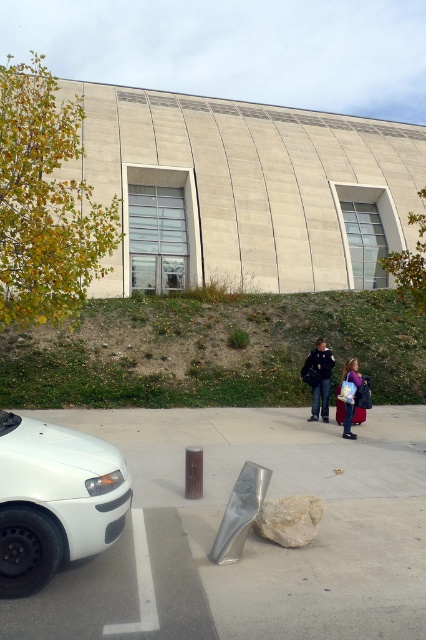
Question: Considering the real-world distances, which object is closest to the metallic silver pavement at lower center?

Choices:
 (A) light beige rock at lower center
 (B) green grassy hillside at lower left
 (C) dark blue jacket at center

Answer: (A)

Question: Does white matte car at lower left come behind light beige rock at lower center?

Choices:
 (A) no
 (B) yes

Answer: (A)

Question: Which point is farther to the camera?

Choices:
 (A) (39, 483)
 (B) (293, 522)
 (C) (252, 364)

Answer: (C)

Question: Can you confirm if white matte car at lower left is positioned to the left of light beige rock at lower center?

Choices:
 (A) yes
 (B) no

Answer: (A)

Question: Is green grassy hillside at lower left thinner than light beige rock at lower center?

Choices:
 (A) yes
 (B) no

Answer: (B)

Question: Which of the following is the farthest from the observer?

Choices:
 (A) (17, 540)
 (B) (353, 387)

Answer: (B)